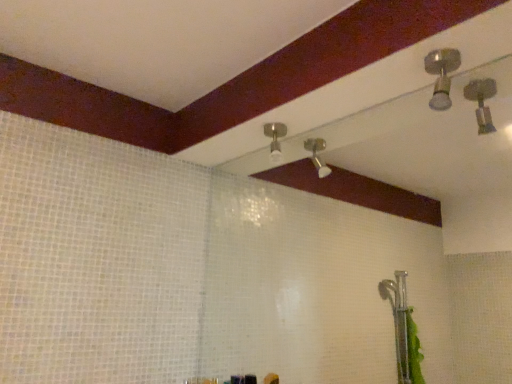
Locate an element on the screen. satin silver spotlight at upper right is located at coordinates (442, 75).

What do you see at coordinates (442, 75) in the screenshot? This screenshot has height=384, width=512. I see `satin silver spotlight at upper right` at bounding box center [442, 75].

Identify the location of satin silver spotlight at upper right. (442, 75).